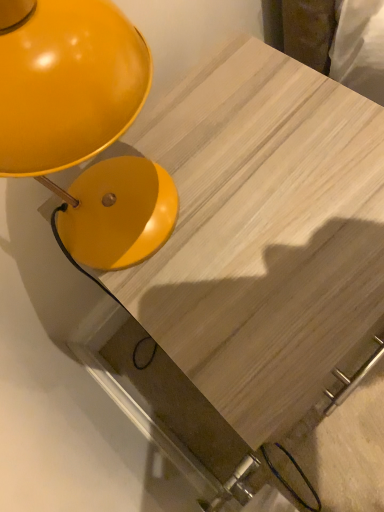
Locate an element on the screen. glossy yellow lamp at upper left is located at coordinates (68, 85).

This screenshot has width=384, height=512. Describe the element at coordinates (68, 85) in the screenshot. I see `glossy yellow lamp at upper left` at that location.

Locate an element on the screen. glossy yellow lamp at upper left is located at coordinates (68, 85).